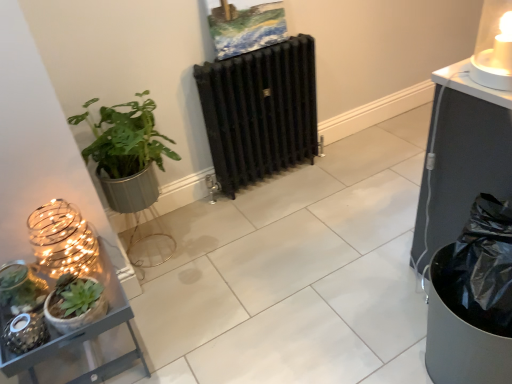
Locate an element on the screen. The height and width of the screenshot is (384, 512). vacant space in front of green matte plant at left, the 1th houseplant when ordered from back to front is located at coordinates (179, 289).